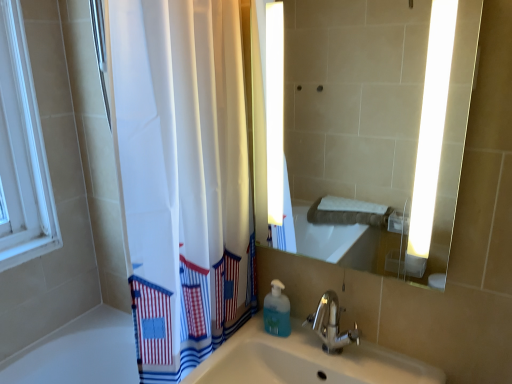
Question: Considering the relative sizes of matte glass mirror at center and blue translucent soap dispenser at lower center in the image provided, is matte glass mirror at center thinner than blue translucent soap dispenser at lower center?

Choices:
 (A) no
 (B) yes

Answer: (B)

Question: Is matte glass mirror at center wider than blue translucent soap dispenser at lower center?

Choices:
 (A) no
 (B) yes

Answer: (A)

Question: Is matte glass mirror at center closer to camera compared to blue translucent soap dispenser at lower center?

Choices:
 (A) no
 (B) yes

Answer: (B)

Question: From the image's perspective, is matte glass mirror at center beneath blue translucent soap dispenser at lower center?

Choices:
 (A) yes
 (B) no

Answer: (B)

Question: Is matte glass mirror at center touching blue translucent soap dispenser at lower center?

Choices:
 (A) no
 (B) yes

Answer: (A)

Question: From the image's perspective, relative to chrome metallic faucet at center, is matte glass mirror at center above or below?

Choices:
 (A) above
 (B) below

Answer: (A)

Question: In terms of width, does matte glass mirror at center look wider or thinner when compared to chrome metallic faucet at center?

Choices:
 (A) thin
 (B) wide

Answer: (A)

Question: Considering the positions of matte glass mirror at center and chrome metallic faucet at center in the image, is matte glass mirror at center bigger or smaller than chrome metallic faucet at center?

Choices:
 (A) big
 (B) small

Answer: (A)

Question: From a real-world perspective, relative to chrome metallic faucet at center, is matte glass mirror at center vertically above or below?

Choices:
 (A) below
 (B) above

Answer: (B)

Question: From a real-world perspective, relative to chrome metallic faucet at center, is blue translucent soap dispenser at lower center vertically above or below?

Choices:
 (A) below
 (B) above

Answer: (A)

Question: Is blue translucent soap dispenser at lower center taller or shorter than chrome metallic faucet at center?

Choices:
 (A) short
 (B) tall

Answer: (A)

Question: Is blue translucent soap dispenser at lower center wider or thinner than chrome metallic faucet at center?

Choices:
 (A) thin
 (B) wide

Answer: (A)

Question: Do you think blue translucent soap dispenser at lower center is within chrome metallic faucet at center, or outside of it?

Choices:
 (A) inside
 (B) outside

Answer: (B)

Question: Considering the positions of blue translucent soap dispenser at lower center and matte glass mirror at center in the image, is blue translucent soap dispenser at lower center wider or thinner than matte glass mirror at center?

Choices:
 (A) thin
 (B) wide

Answer: (B)

Question: Is blue translucent soap dispenser at lower center in front of or behind matte glass mirror at center in the image?

Choices:
 (A) behind
 (B) front

Answer: (A)